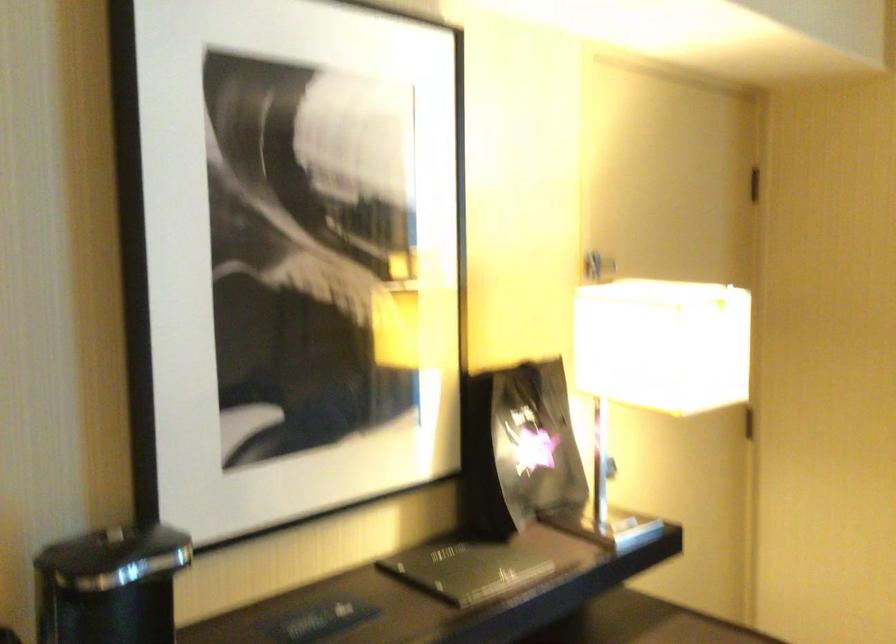
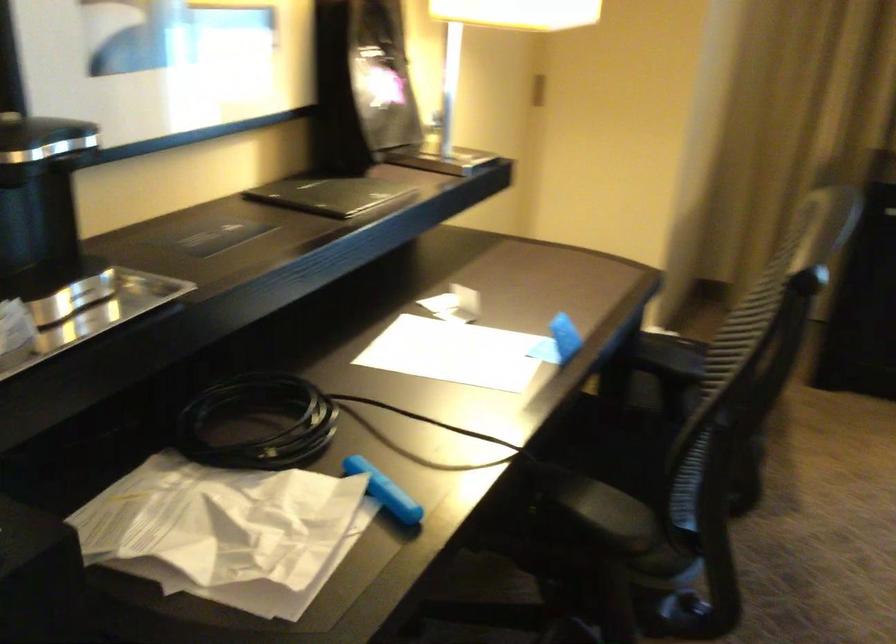
Question: The images are taken continuously from a first-person perspective. In which direction are you moving?

Choices:
 (A) Left
 (B) Right
 (C) Forward
 (D) Backward

Answer: (A)